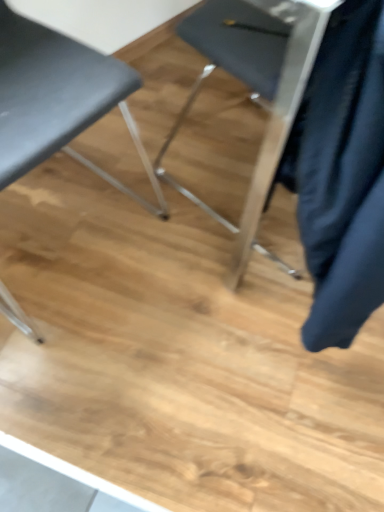
Question: Should I look upward or downward to see matte black chair at center, arranged as the second chair when viewed from the left?

Choices:
 (A) up
 (B) down

Answer: (A)

Question: Is matte black chair at left, the first chair in the left-to-right sequence, positioned behind matte black chair at center, arranged as the second chair when viewed from the left?

Choices:
 (A) no
 (B) yes

Answer: (A)

Question: Considering the relative sizes of matte black chair at left, the first chair in the left-to-right sequence, and matte black chair at center, arranged as the second chair when viewed from the left, in the image provided, is matte black chair at left, the first chair in the left-to-right sequence, taller than matte black chair at center, arranged as the second chair when viewed from the left,?

Choices:
 (A) no
 (B) yes

Answer: (B)

Question: Can you confirm if matte black chair at left, the first chair in the left-to-right sequence, is positioned to the left of matte black chair at center, the first chair from the right?

Choices:
 (A) yes
 (B) no

Answer: (A)

Question: From the image's perspective, is matte black chair at left, the first chair in the left-to-right sequence, over matte black chair at center, arranged as the second chair when viewed from the left?

Choices:
 (A) yes
 (B) no

Answer: (B)

Question: Is matte black chair at left, the first chair in the left-to-right sequence, closer to camera compared to matte black chair at center, the first chair from the right?

Choices:
 (A) no
 (B) yes

Answer: (B)

Question: From a real-world perspective, is matte black chair at left, the first chair in the left-to-right sequence, under matte black chair at center, the first chair from the right?

Choices:
 (A) no
 (B) yes

Answer: (A)

Question: Is matte black chair at center, the first chair from the right, placed right next to matte black chair at left, the first chair in the left-to-right sequence?

Choices:
 (A) no
 (B) yes

Answer: (A)

Question: Is the depth of matte black chair at center, the first chair from the right, less than that of matte black chair at left, the first chair in the left-to-right sequence?

Choices:
 (A) no
 (B) yes

Answer: (A)

Question: Is matte black chair at center, arranged as the second chair when viewed from the left, located outside matte black chair at left, the second chair positioned from the right?

Choices:
 (A) yes
 (B) no

Answer: (A)

Question: From a real-world perspective, is matte black chair at center, arranged as the second chair when viewed from the left, physically below matte black chair at left, the second chair positioned from the right?

Choices:
 (A) no
 (B) yes

Answer: (B)

Question: Is matte black chair at center, arranged as the second chair when viewed from the left, wider than matte black chair at left, the first chair in the left-to-right sequence?

Choices:
 (A) no
 (B) yes

Answer: (A)

Question: Does matte black chair at center, the first chair from the right, contain matte black chair at left, the second chair positioned from the right?

Choices:
 (A) yes
 (B) no

Answer: (B)

Question: Visually, is matte black chair at center, the first chair from the right, positioned to the left or to the right of matte black chair at left, the second chair positioned from the right?

Choices:
 (A) left
 (B) right

Answer: (B)